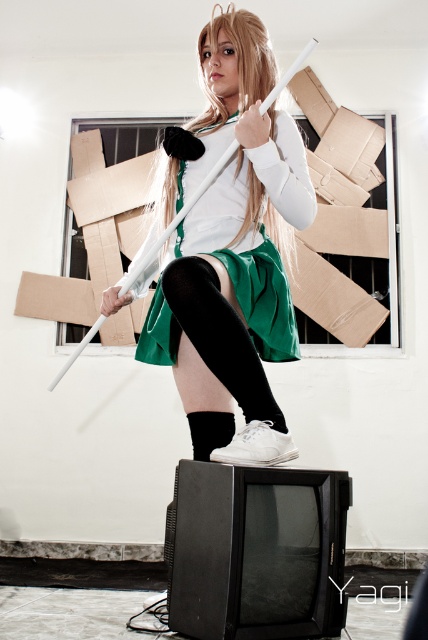
You are a photographer trying to capture the cosplay character from the front. Since the matte white sword at center and the green fabric skirt at center are both in the frame, which one will appear taller in the photo?

The matte white sword at center will appear taller in the photo since it has a greater height compared to the green fabric skirt at center according to the description.

You are a photographer trying to capture a closeup shot of the cosplay character. The matte white sword at center and the green fabric skirt at center are both in focus. If you want to adjust your camera to focus on the wider object, which one should you zoom in on?

The matte white sword at center is wider than the green fabric skirt at center, so you should zoom in on the matte white sword at center to focus on the wider object.